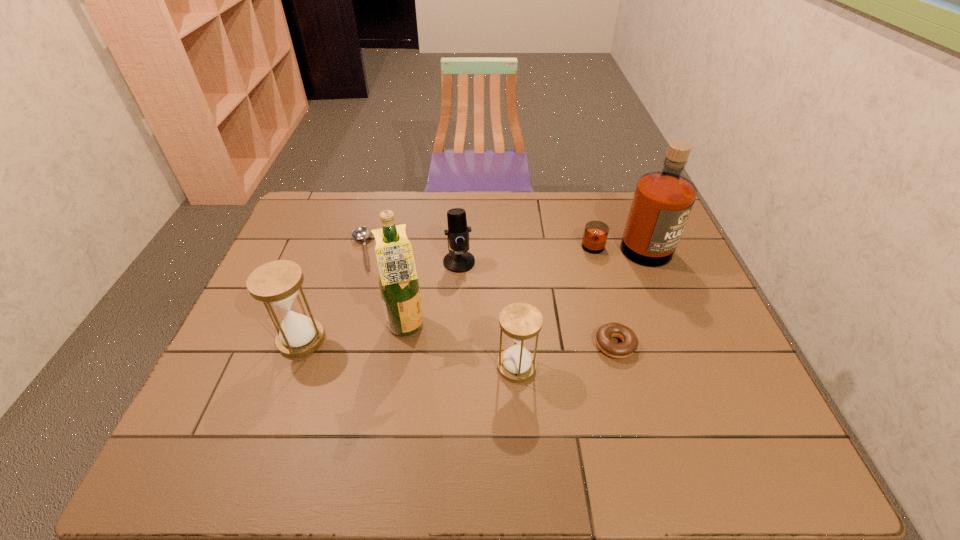
At what (x,y) coordinates should I click in order to perform the action: click on free spot between the taller hourglass and the microphone. Please return your answer as a coordinate pair (x, y). Image resolution: width=960 pixels, height=540 pixels. Looking at the image, I should click on (380, 301).

You are a GUI agent. You are given a task and a screenshot of the screen. Output one action in this format:
    pyautogui.click(x=<x>, y=<y>)
    Task: Click on the empty space that is in between the right hourglass and the fifth shortest object
    Image resolution: width=960 pixels, height=540 pixels.
    Given the screenshot: What is the action you would take?
    pyautogui.click(x=409, y=353)

I want to click on unoccupied position between the shorter hourglass and the sixth tallest object, so click(565, 356).

Locate an element on the screen. The image size is (960, 540). blank region between the doughnut and the ladle is located at coordinates (489, 298).

Identify the location of free space between the taller hourglass and the shortest object. This screenshot has width=960, height=540. (331, 295).

The height and width of the screenshot is (540, 960). Find the location of `the closest object to the farther liquor`. the closest object to the farther liquor is located at coordinates (629, 344).

Where is `object that is the fifth nearest to the ladle`? The height and width of the screenshot is (540, 960). object that is the fifth nearest to the ladle is located at coordinates (662, 202).

Image resolution: width=960 pixels, height=540 pixels. I want to click on free spot that satisfies the following two spatial constraints: 1. on the stand of the fifth object from left to right; 2. on the right side of the microphone, so click(x=454, y=367).

Image resolution: width=960 pixels, height=540 pixels. In order to click on free spot that satisfies the following two spatial constraints: 1. on the stand of the third object from right to left; 2. on the right side of the microphone in this screenshot , I will do `click(454, 367)`.

Identify the location of free spot that satisfies the following two spatial constraints: 1. on the front-facing side of the left liquor; 2. on the right side of the right hourglass. The width and height of the screenshot is (960, 540). (401, 367).